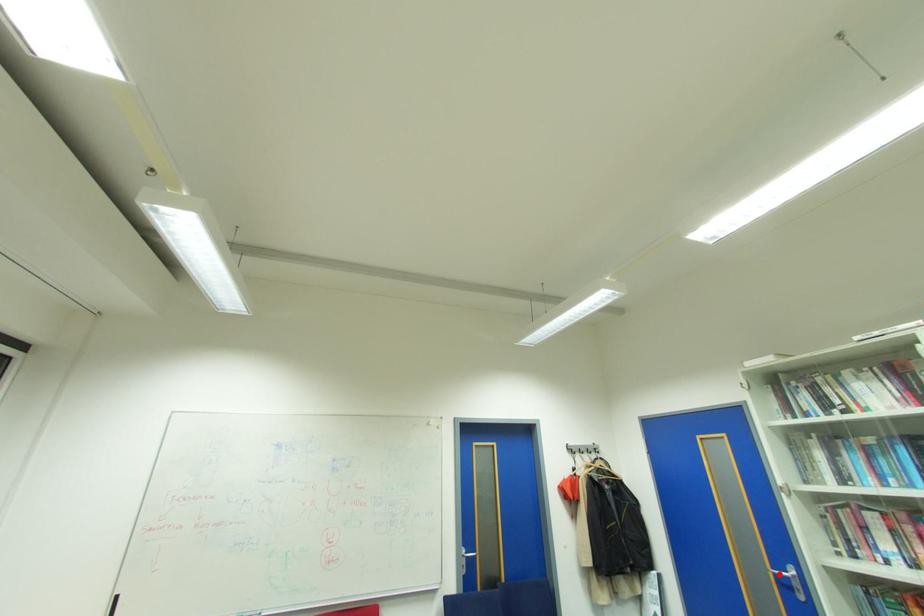
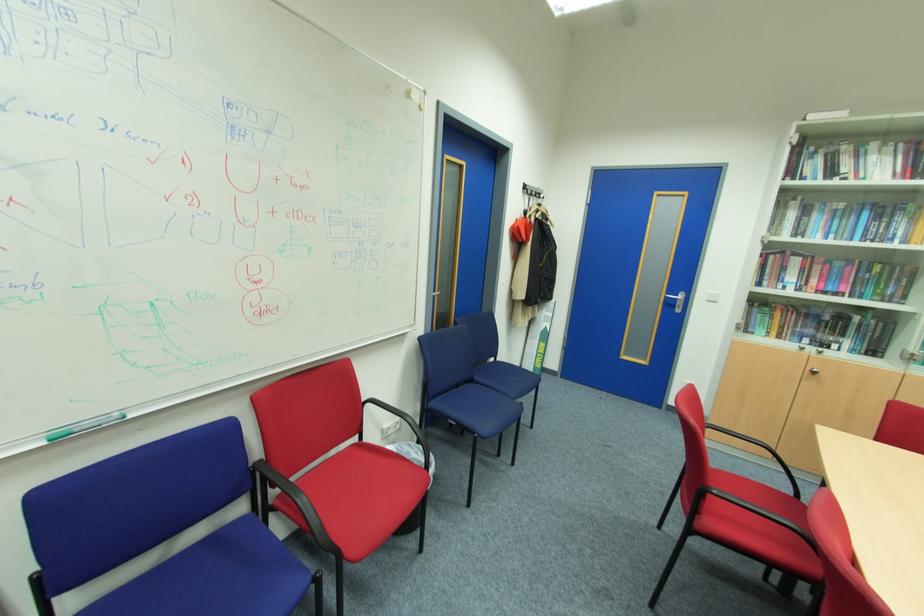
The point at the highlighted location is marked in the first image. Where is the corresponding point in the second image?

(670, 298)